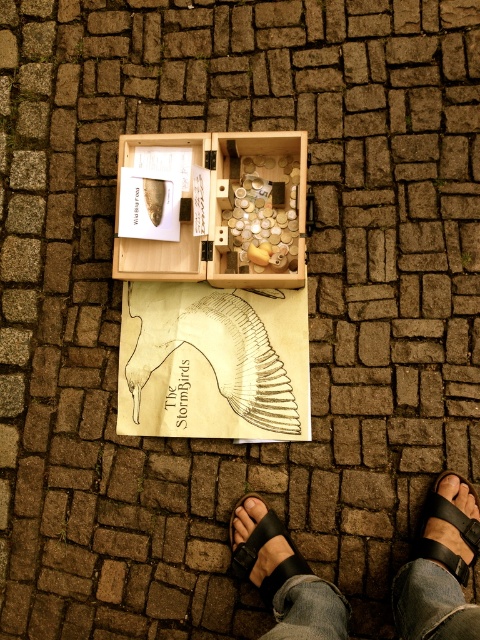
Can you confirm if wooden box at center is positioned to the right of black leather sandal at lower center?

No, wooden box at center is not to the right of black leather sandal at lower center.

Does wooden box at center have a smaller size compared to black leather sandal at lower center?

No.

This screenshot has height=640, width=480. In order to click on wooden box at center in this screenshot , I will do `click(219, 209)`.

Which is above, black leather sandals at lower center or black leather sandal at lower right?

black leather sandal at lower right is above.

Which of these two, black leather sandals at lower center or black leather sandal at lower right, stands taller?

black leather sandals at lower center

The width and height of the screenshot is (480, 640). What do you see at coordinates (441, 568) in the screenshot? I see `black leather sandals at lower center` at bounding box center [441, 568].

Find the location of a particular element. This screenshot has width=480, height=640. black leather sandals at lower center is located at coordinates (441, 568).

Does black leather sandals at lower center have a lesser width compared to black leather sandal at lower center?

In fact, black leather sandals at lower center might be wider than black leather sandal at lower center.

Does point (276, 557) lie in front of point (259, 550)?

Yes, point (276, 557) is closer to viewer.

Image resolution: width=480 pixels, height=640 pixels. I want to click on black leather sandals at lower center, so click(x=441, y=568).